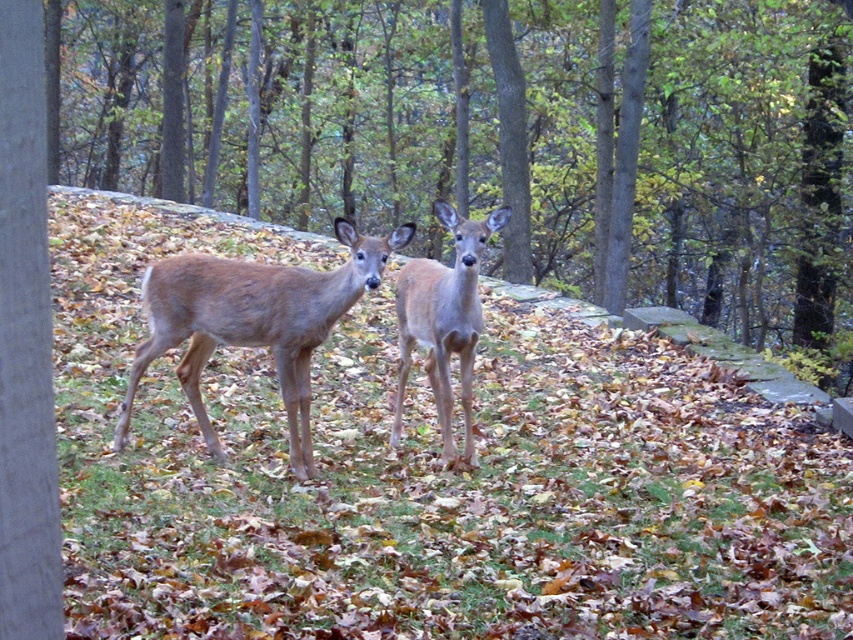
Question: Among these points, which one is nearest to the camera?

Choices:
 (A) (495, 170)
 (B) (466, 304)
 (C) (299, 282)

Answer: (C)

Question: From the image, what is the correct spatial relationship of brown fur deer at center in relation to light brown fur at center?

Choices:
 (A) left
 (B) right

Answer: (A)

Question: Among these objects, which one is nearest to the camera?

Choices:
 (A) brown matte/deer at center
 (B) brown fur deer at center

Answer: (A)

Question: Is brown fur deer at center behind light brown fur at center?

Choices:
 (A) yes
 (B) no

Answer: (A)

Question: Which of the following is the closest to the observer?

Choices:
 (A) brown fur deer at center
 (B) light brown fur at center
 (C) brown matte/deer at center

Answer: (C)

Question: Does brown matte/deer at center come in front of light brown fur at center?

Choices:
 (A) no
 (B) yes

Answer: (B)